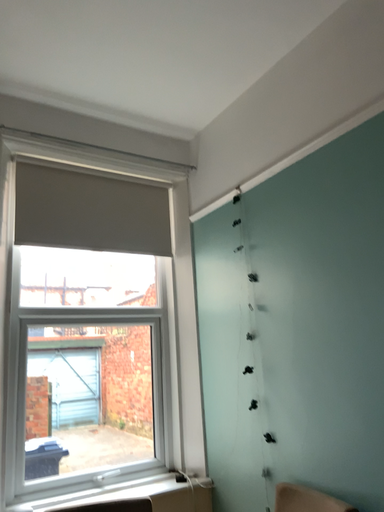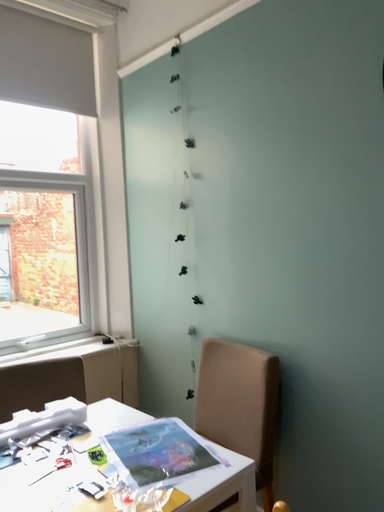
Question: How did the camera likely rotate when shooting the video?

Choices:
 (A) rotated left
 (B) rotated right

Answer: (B)